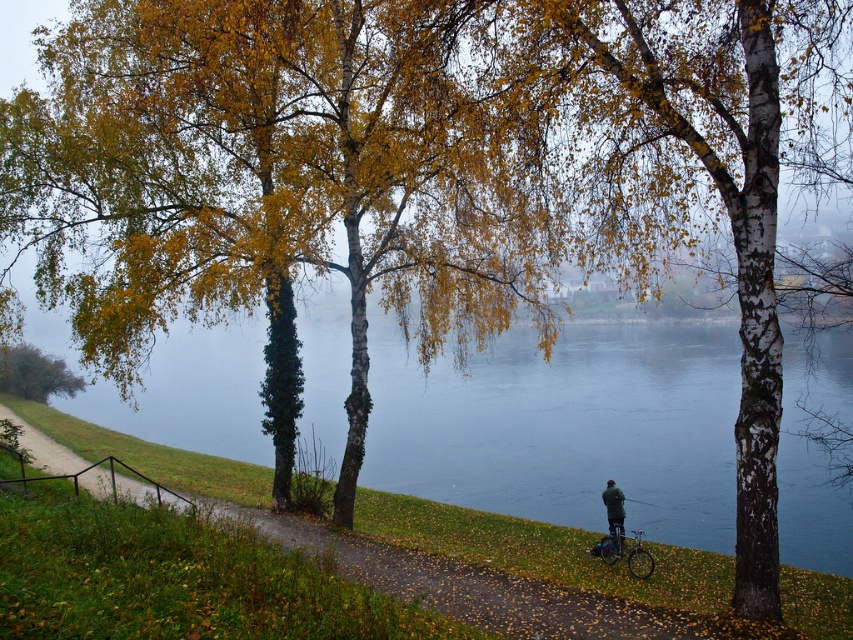
From the picture: Between silver metallic bicycle at lower right and dark green jacket at lower right, which one is positioned higher?

dark green jacket at lower right is higher up.

Is silver metallic bicycle at lower right further to camera compared to dark green jacket at lower right?

No, silver metallic bicycle at lower right is in front of dark green jacket at lower right.

At what (x,y) coordinates should I click in order to perform the action: click on silver metallic bicycle at lower right. Please return your answer as a coordinate pair (x, y). This screenshot has width=853, height=640. Looking at the image, I should click on (625, 552).

The image size is (853, 640). What are the coordinates of `silver metallic bicycle at lower right` in the screenshot? It's located at (625, 552).

Image resolution: width=853 pixels, height=640 pixels. Identify the location of blue water at center. (567, 424).

Between point (634, 420) and point (619, 548), which one is positioned in front?

Point (619, 548)

Which is behind, point (628, 362) or point (610, 481)?

The point (628, 362) is behind.

Locate an element on the screen. The height and width of the screenshot is (640, 853). blue water at center is located at coordinates (567, 424).

Is green matte tree at lower left wider than silver metallic bicycle at lower right?

No, green matte tree at lower left is not wider than silver metallic bicycle at lower right.

Which is behind, point (62, 369) or point (614, 544)?

The point (62, 369) is behind.

Between point (51, 381) and point (647, 556), which one is positioned in front?

Positioned in front is point (647, 556).

The image size is (853, 640). Find the location of `green matte tree at lower left`. green matte tree at lower left is located at coordinates (35, 372).